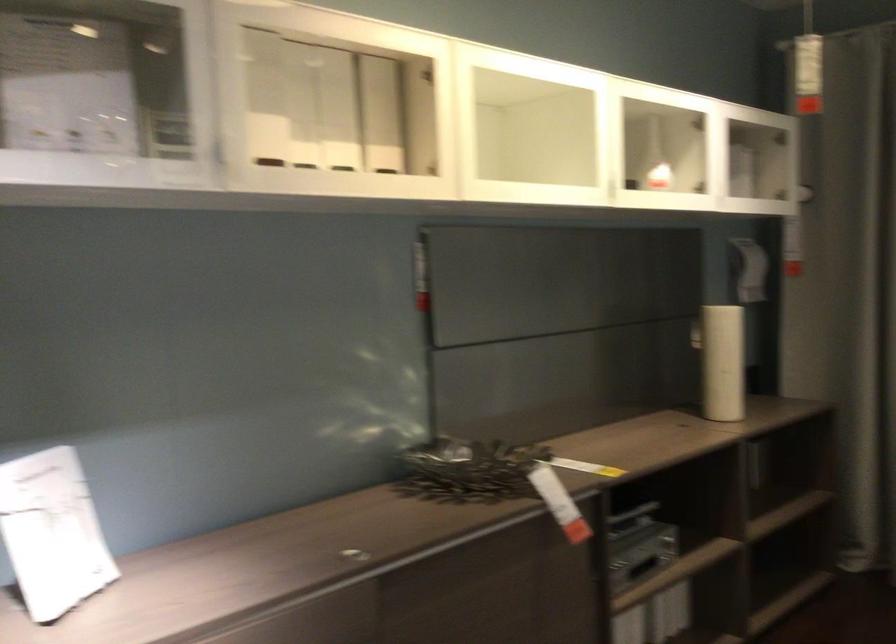
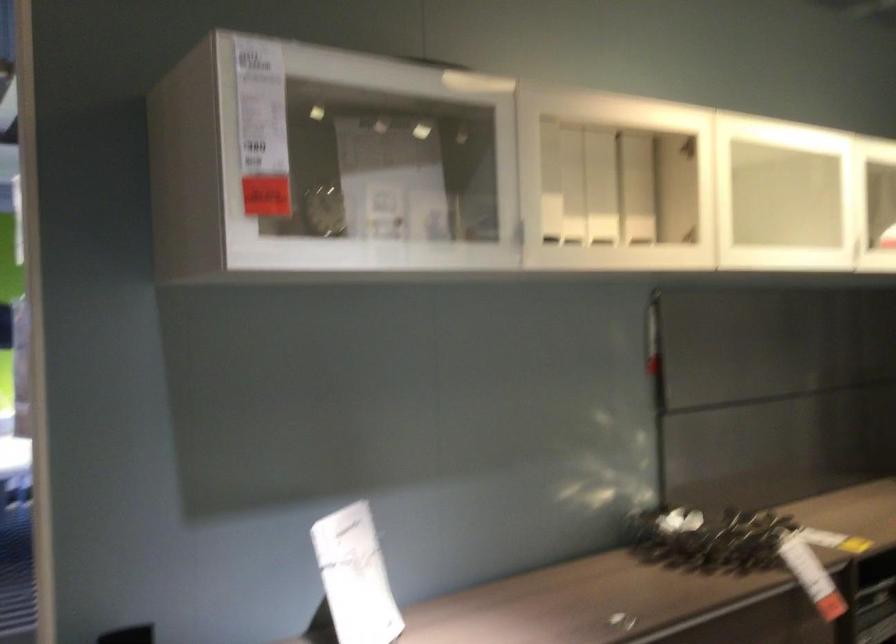
Locate, in the second image, the point that corresponds to (233,151) in the first image.

(519, 232)